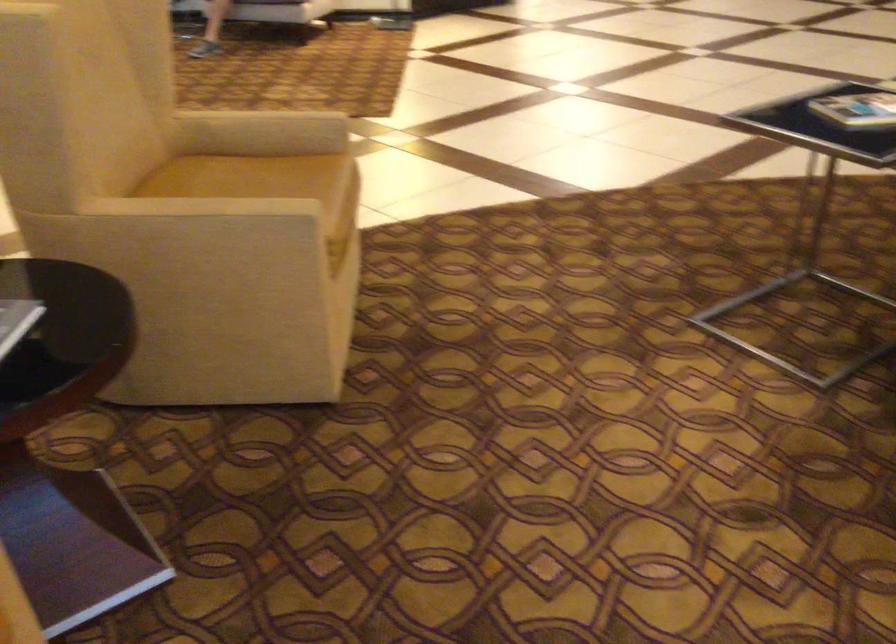
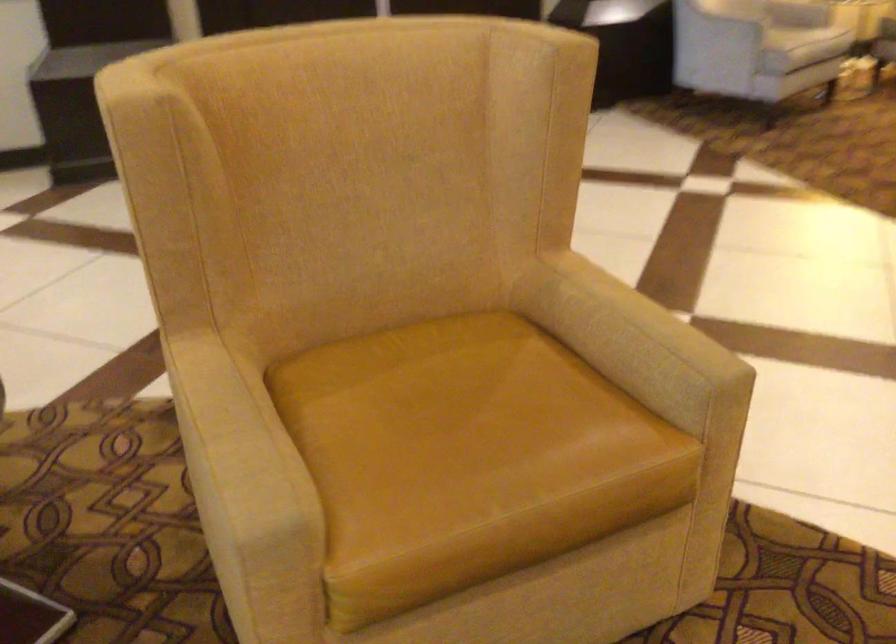
The point at (226,205) is marked in the first image. Where is the corresponding point in the second image?

(235, 435)